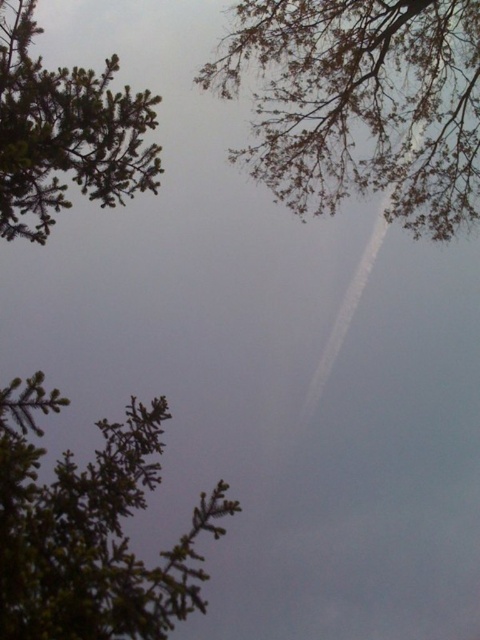
Question: Is brown textured branches at upper center to the right of green matte tree at upper left from the viewer's perspective?

Choices:
 (A) yes
 (B) no

Answer: (A)

Question: Which of the following is the closest to the observer?

Choices:
 (A) (377, 120)
 (B) (12, 403)

Answer: (B)

Question: Which point is closer to the camera?

Choices:
 (A) green matte tree at lower left
 (B) brown textured branches at upper center

Answer: (A)

Question: Does brown textured branches at upper center have a larger size compared to green matte tree at upper left?

Choices:
 (A) yes
 (B) no

Answer: (A)

Question: In this image, where is green matte tree at lower left located relative to green matte tree at upper left?

Choices:
 (A) right
 (B) left

Answer: (A)

Question: Which point is closer to the camera?

Choices:
 (A) (319, 35)
 (B) (66, 115)
 (C) (0, 556)

Answer: (C)